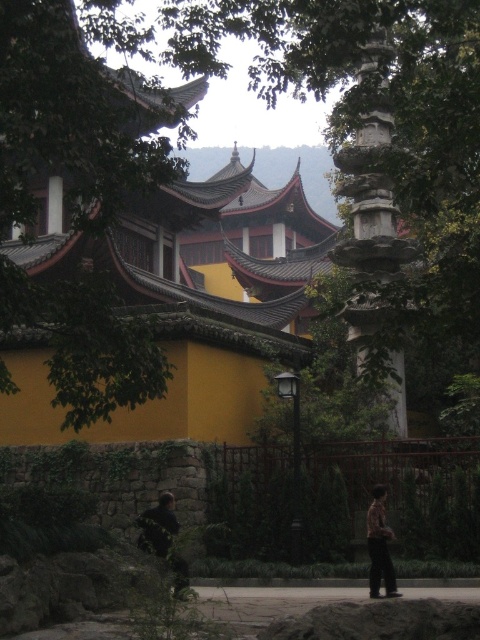
You are standing in front of the pagoda and see the dark brown leather jacket at lower center. If you want to reach the jacket, which direction should you move relative to your current position?

The dark brown leather jacket at lower center is located at coordinates 0.823 on the x axis and 0.329 on the y axis. Since the jacket is at lower center, you should move forward slightly towards the center to reach it.

You are standing in front of the pagoda and want to reach the point at coordinates point (172, 592). Given that the path is 130.79 feet long, can you walk there without any obstacles?

The point at coordinates point (172, 592) is 130.79 feet away from you, so yes, you can walk there as there are no obstacles mentioned in the scene description.

You are a tailor who needs to determine which clothing item takes up more horizontal space. Based on the scene, which item is wider between the dark brown leather jacket at lower center and the brown textured shirt at lower right?

The dark brown leather jacket at lower center might be wider than brown textured shirt at lower right according to the description.